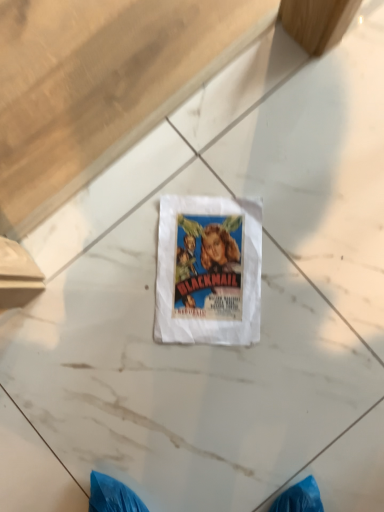
Locate an element on the screen. This screenshot has width=384, height=512. free point above colorful paper poster at center (from a real-world perspective) is located at coordinates (210, 265).